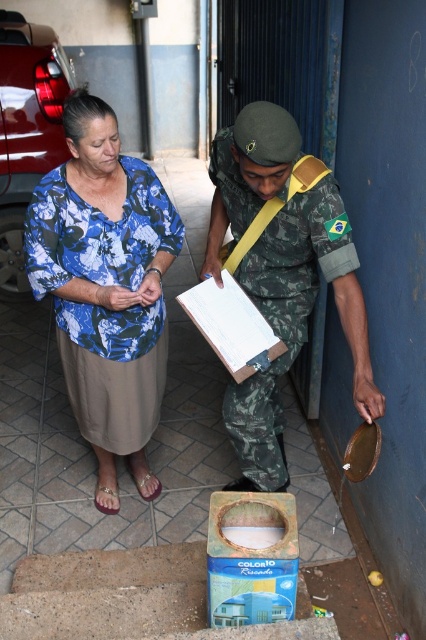
Question: Which point is farther to the camera?

Choices:
 (A) white cardboard clipboard at center
 (B) blue floral blouse at center

Answer: (A)

Question: Which is nearer to the blue floral blouse at center?

Choices:
 (A) camouflage uniform at center
 (B) white cardboard clipboard at center

Answer: (B)

Question: Is camouflage uniform at center to the left of white cardboard clipboard at center from the viewer's perspective?

Choices:
 (A) no
 (B) yes

Answer: (A)

Question: Among these objects, which one is farthest from the camera?

Choices:
 (A) white cardboard clipboard at center
 (B) blue floral blouse at center
 (C) camouflage uniform at center

Answer: (A)

Question: Can you confirm if camouflage uniform at center is positioned below white cardboard clipboard at center?

Choices:
 (A) yes
 (B) no

Answer: (A)

Question: Observing the image, what is the correct spatial positioning of blue floral blouse at center in reference to camouflage uniform at center?

Choices:
 (A) right
 (B) left

Answer: (B)